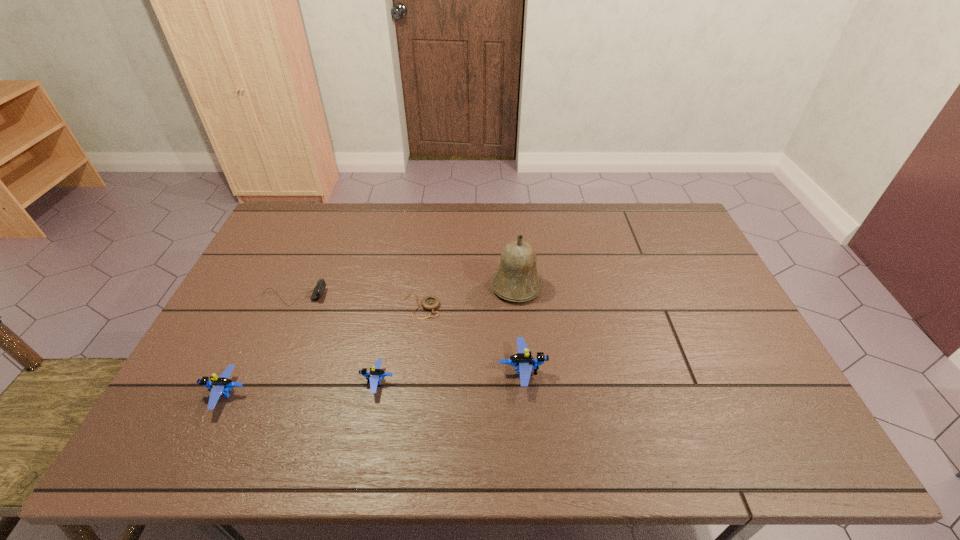
Identify the location of the third tallest object. The image size is (960, 540). (219, 386).

Locate an element on the screen. Image resolution: width=960 pixels, height=540 pixels. the leftmost Lego is located at coordinates pos(219,386).

Where is `the fourth tallest object`? The height and width of the screenshot is (540, 960). the fourth tallest object is located at coordinates (375, 375).

Locate an element on the screen. This screenshot has height=540, width=960. the shortest Lego is located at coordinates (375, 375).

This screenshot has height=540, width=960. Find the location of `the tallest Lego`. the tallest Lego is located at coordinates (524, 363).

The width and height of the screenshot is (960, 540). What are the coordinates of `the rightmost Lego` in the screenshot? It's located at (524, 363).

Identify the location of webcam. (318, 291).

I want to click on the tallest object, so click(517, 279).

Image resolution: width=960 pixels, height=540 pixels. Identify the location of the shortest object. (429, 303).

This screenshot has width=960, height=540. I want to click on vacant space positioned on the front-facing side of the third tallest object, so click(x=177, y=394).